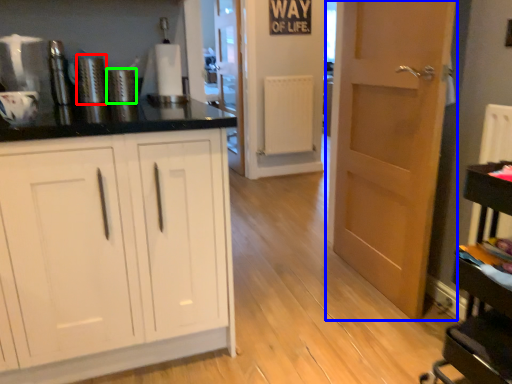
Question: Which object is the farthest from appliance (highlighted by a red box)? Choose among these: door (highlighted by a blue box) or appliance (highlighted by a green box).

Choices:
 (A) door
 (B) appliance

Answer: (A)